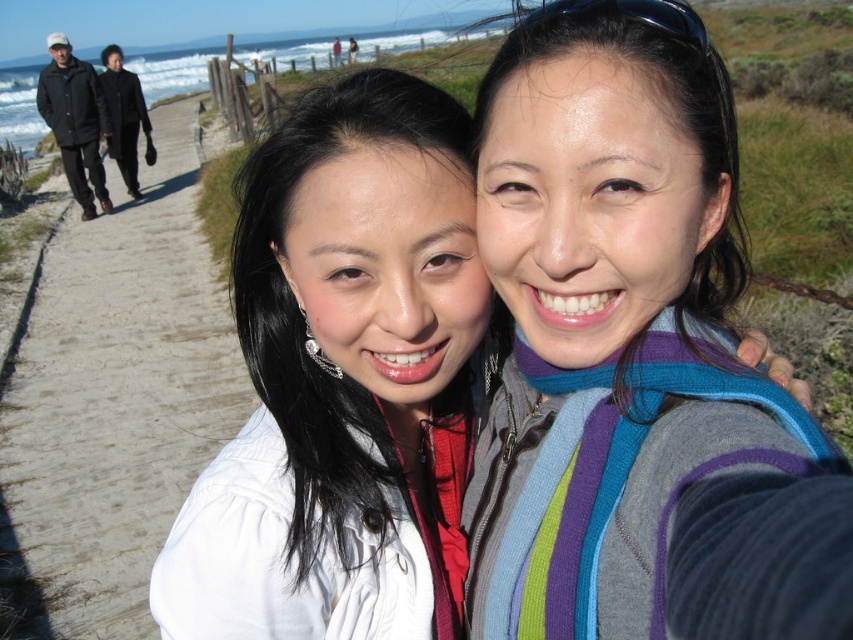
From the picture: You are planning to take a photo of the white matte jacket at center and the brown dirt path at center. Which object should you focus on if you want to capture both in a single frame without moving the camera?

You should focus on the brown dirt path at center because it occupies more space than the white matte jacket at center, allowing both to fit within the frame.

Looking at this image, you are standing at the starting point of the coastal path and want to reach the ocean as quickly as possible. Which direction should you head towards from the brown dirt path at center?

The brown dirt path at center leads towards the ocean, so heading straight along the brown dirt path at center would be the quickest way to reach the ocean.